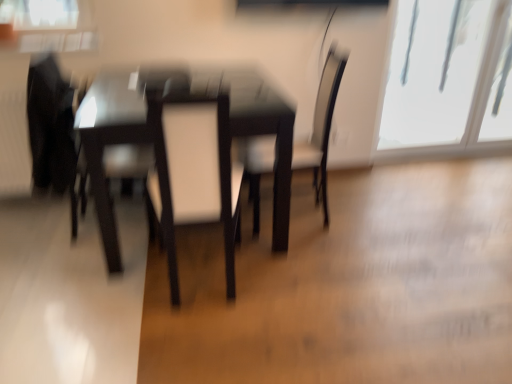
Where is `vacant space underneath white leather swivel chair at center, marked as the 2th swivel chair in a left-to-right arrangement (from a real-world perspective)`? The width and height of the screenshot is (512, 384). vacant space underneath white leather swivel chair at center, marked as the 2th swivel chair in a left-to-right arrangement (from a real-world perspective) is located at coordinates (203, 279).